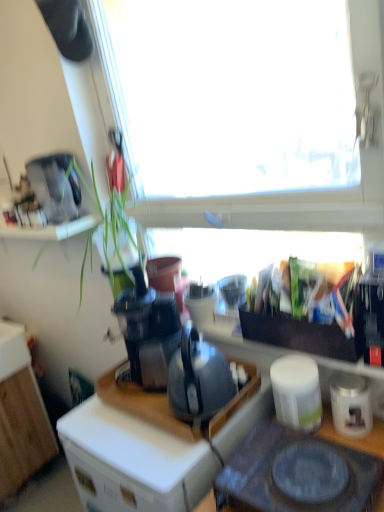
Question: Is matte black desk at center to the left of white plastic drawer at lower left from the viewer's perspective?

Choices:
 (A) no
 (B) yes

Answer: (A)

Question: Is matte black desk at center further to camera compared to white plastic drawer at lower left?

Choices:
 (A) yes
 (B) no

Answer: (B)

Question: From a real-world perspective, is matte black desk at center located beneath white plastic drawer at lower left?

Choices:
 (A) no
 (B) yes

Answer: (B)

Question: From the image's perspective, is matte black desk at center beneath white plastic drawer at lower left?

Choices:
 (A) no
 (B) yes

Answer: (B)

Question: Is matte black desk at center positioned before white plastic drawer at lower left?

Choices:
 (A) yes
 (B) no

Answer: (A)

Question: In terms of height, does wooden cabinet at lower left look taller or shorter compared to white plastic drawer at lower left?

Choices:
 (A) short
 (B) tall

Answer: (B)

Question: From the image's perspective, is wooden cabinet at lower left located above or below white plastic drawer at lower left?

Choices:
 (A) above
 (B) below

Answer: (B)

Question: Is wooden cabinet at lower left bigger or smaller than white plastic drawer at lower left?

Choices:
 (A) big
 (B) small

Answer: (A)

Question: Choose the correct answer: Is wooden cabinet at lower left inside white plastic drawer at lower left or outside it?

Choices:
 (A) outside
 (B) inside

Answer: (A)

Question: In the image, is black glass gas stove at lower center positioned in front of or behind black plastic coffee machine at center?

Choices:
 (A) front
 (B) behind

Answer: (A)

Question: Is point (354, 499) closer or farther from the camera than point (158, 366)?

Choices:
 (A) farther
 (B) closer

Answer: (B)

Question: From the image's perspective, is black glass gas stove at lower center positioned above or below black plastic coffee machine at center?

Choices:
 (A) above
 (B) below

Answer: (B)

Question: Would you say black glass gas stove at lower center is to the left or to the right of black plastic coffee machine at center in the picture?

Choices:
 (A) left
 (B) right

Answer: (B)

Question: Does point (309, 441) appear closer or farther from the camera than point (51, 208)?

Choices:
 (A) closer
 (B) farther

Answer: (A)

Question: Is black glass gas stove at lower center bigger or smaller than satin silver coffee maker at upper left, positioned as the first appliance in left-to-right order?

Choices:
 (A) big
 (B) small

Answer: (A)